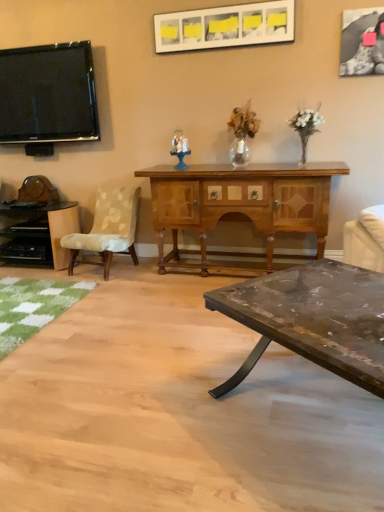
Where is `free region under rustic wood coffee table at lower right (from a real-world perspective)`? free region under rustic wood coffee table at lower right (from a real-world perspective) is located at coordinates (322, 409).